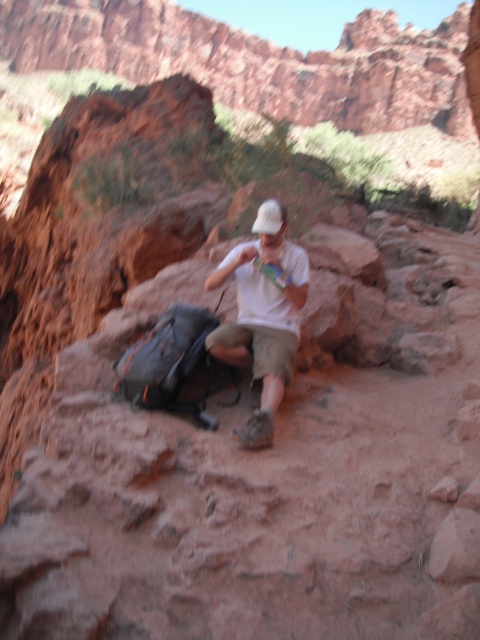
You are a photographer trying to capture a clear shot of the person in the desert. You notice the white cotton shirt at center and the white matte baseball hat at center. Which object should you focus on first to ensure both are in focus, considering their positions?

The white cotton shirt at center is closer to the viewer than the white matte baseball hat at center, so focus on the white cotton shirt at center first to ensure both are in focus.

You are a photographer planning to take a portrait of the person in the desert scene. You need to ensure that the white cotton shirt at center and the white matte baseball hat at center are both clearly visible. Since both are white, could the height difference between them cause any issues with the lighting or visibility?

The white cotton shirt at center has a greater height compared to the white matte baseball hat at center. This means the shirt may receive more direct light, potentially creating a contrast that helps differentiate the two white items in the photo.

You are a photographer planning to capture a landscape shot of the canyon. You need to ensure that the white cotton shirt at center is visible in the frame. Given the current setup, where should you position the camera relative to the point marked at (263, 316) to include the shirt in the shot?

The white cotton shirt at center is located exactly at the point marked at (263, 316). Therefore, positioning the camera directly facing this point will ensure the shirt is centered in the frame.